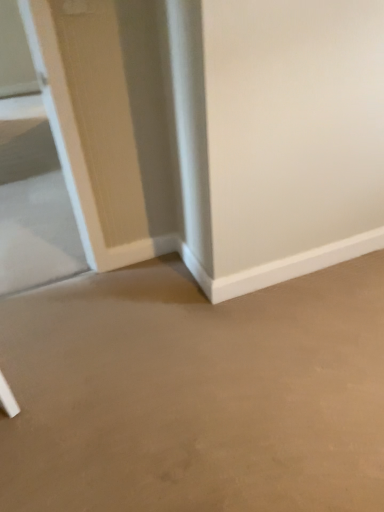
Question: Considering the relative sizes of beige matte concrete at center and clear glass door at left in the image provided, is beige matte concrete at center shorter than clear glass door at left?

Choices:
 (A) yes
 (B) no

Answer: (B)

Question: Is beige matte concrete at center not inside clear glass door at left?

Choices:
 (A) no
 (B) yes

Answer: (B)

Question: Is beige matte concrete at center bigger than clear glass door at left?

Choices:
 (A) no
 (B) yes

Answer: (B)

Question: Is beige matte concrete at center wider than clear glass door at left?

Choices:
 (A) no
 (B) yes

Answer: (A)

Question: Is there a large distance between beige matte concrete at center and clear glass door at left?

Choices:
 (A) yes
 (B) no

Answer: (A)

Question: Is beige matte concrete at center facing away from clear glass door at left?

Choices:
 (A) no
 (B) yes

Answer: (A)

Question: Is clear glass door at left further to camera compared to beige matte concrete at center?

Choices:
 (A) no
 (B) yes

Answer: (B)

Question: From a real-world perspective, does clear glass door at left stand above beige matte concrete at center?

Choices:
 (A) yes
 (B) no

Answer: (B)

Question: From the image's perspective, is clear glass door at left beneath beige matte concrete at center?

Choices:
 (A) yes
 (B) no

Answer: (B)

Question: Does clear glass door at left have a lesser width compared to beige matte concrete at center?

Choices:
 (A) no
 (B) yes

Answer: (A)

Question: Is beige matte concrete at center located within clear glass door at left?

Choices:
 (A) no
 (B) yes

Answer: (A)

Question: Is clear glass door at left at the left side of beige matte concrete at center?

Choices:
 (A) no
 (B) yes

Answer: (B)

Question: Is clear glass door at left inside the boundaries of beige matte concrete at center, or outside?

Choices:
 (A) outside
 (B) inside

Answer: (A)